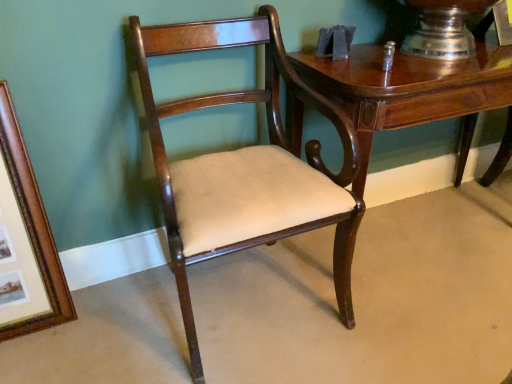
Where is `vacant space underneath mahogany wood chair at center (from a real-world perspective)`? This screenshot has height=384, width=512. vacant space underneath mahogany wood chair at center (from a real-world perspective) is located at coordinates (249, 297).